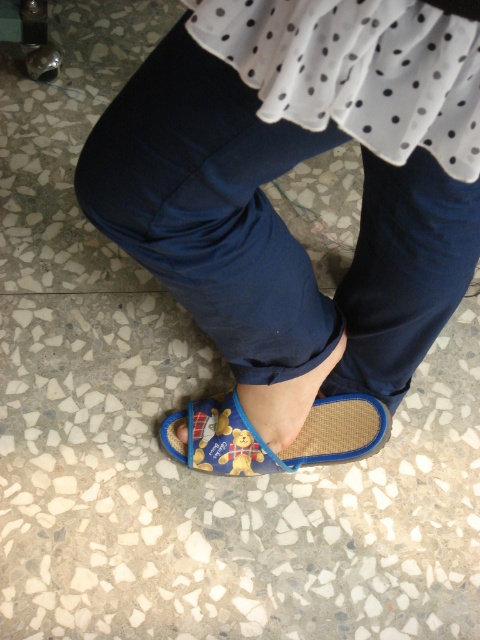
Describe the element at coordinates (357, 70) in the screenshot. I see `white dotted fabric at upper center` at that location.

Is point (427, 100) behind point (214, 445)?

That is False.

Between point (380, 154) and point (250, 474), which one is positioned behind?

Positioned behind is point (250, 474).

Where is `white dotted fabric at upper center`? white dotted fabric at upper center is located at coordinates (357, 70).

Between blue fabric pants at lower center and blue fabric toe at lower center, which one is positioned higher?

blue fabric pants at lower center

Does blue fabric pants at lower center appear under blue fabric toe at lower center?

Incorrect, blue fabric pants at lower center is not positioned below blue fabric toe at lower center.

Measure the distance between point [265,144] and camera.

They are 22.32 inches apart.

You are a GUI agent. You are given a task and a screenshot of the screen. Output one action in this format:
    pyautogui.click(x=<x>, y=<y>)
    Task: Click on the blue fabric pants at lower center
    The image size is (480, 640).
    Given the screenshot: What is the action you would take?
    pyautogui.click(x=279, y=216)

Is blue fabric pants at lower center to the left of white dotted fabric at upper center from the viewer's perspective?

Yes, blue fabric pants at lower center is to the left of white dotted fabric at upper center.

Between blue fabric pants at lower center and white dotted fabric at upper center, which one has less height?

white dotted fabric at upper center

Between point (252, 32) and point (446, 68), which one is positioned in front?

Point (446, 68) is in front.

I want to click on blue fabric pants at lower center, so click(279, 216).